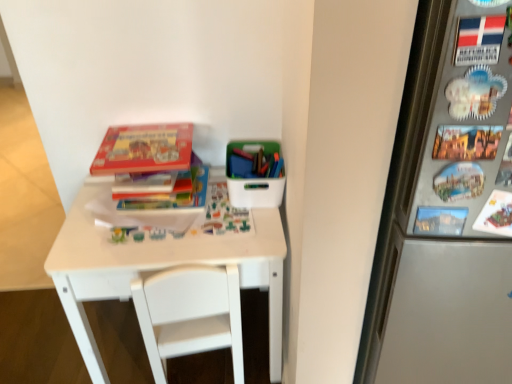
Question: In terms of width, does white plastic container at upper right look wider or thinner when compared to hardcover book at center, the second book when ordered from top to bottom?

Choices:
 (A) wide
 (B) thin

Answer: (A)

Question: Is point (238, 200) closer or farther from the camera than point (199, 193)?

Choices:
 (A) closer
 (B) farther

Answer: (A)

Question: Considering the real-world distances, which object is farthest from the white plastic container at upper right?

Choices:
 (A) hardcover book at center, which ranks as the first book in bottom-to-top order
 (B) matte cardboard book at upper left, acting as the second book starting from the bottom
 (C) white matte table at center
 (D) white plastic chair at center

Answer: (D)

Question: Estimate the real-world distances between objects in this image. Which object is farther from the matte cardboard book at upper left, acting as the second book starting from the bottom?

Choices:
 (A) white plastic chair at center
 (B) white matte table at center
 (C) hardcover book at center, the second book when ordered from top to bottom
 (D) white plastic container at upper right

Answer: (A)